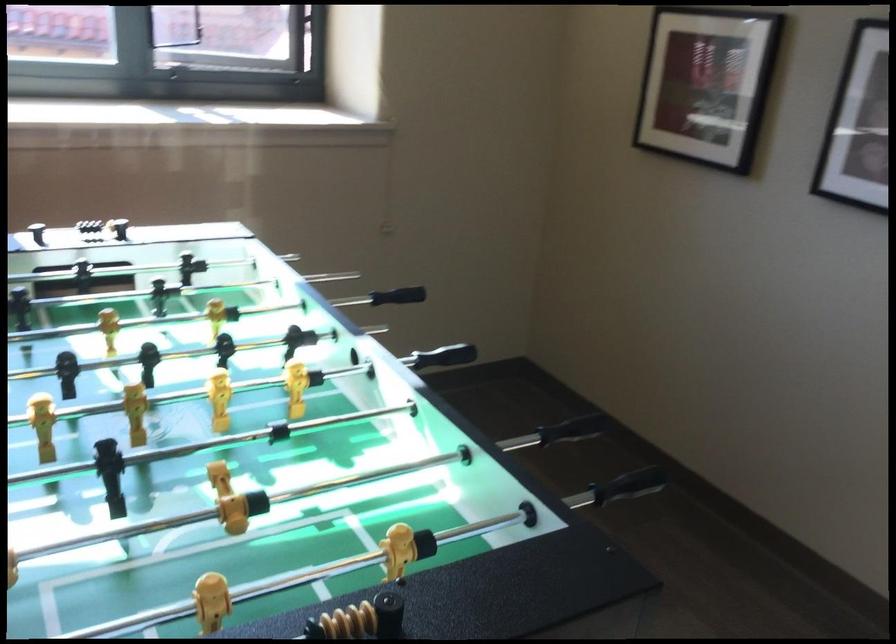
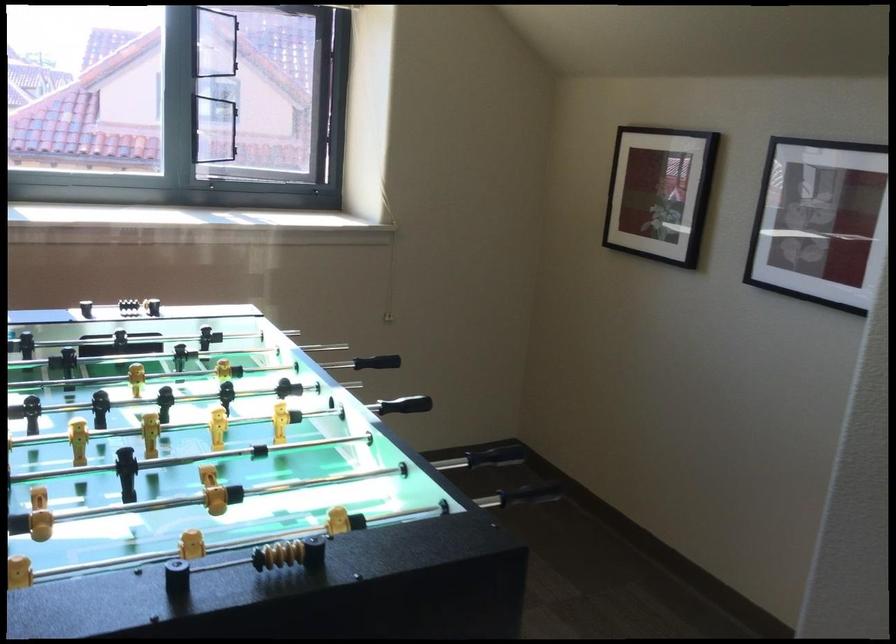
Locate, in the second image, the point that corresponds to point (633, 478) in the first image.

(531, 493)